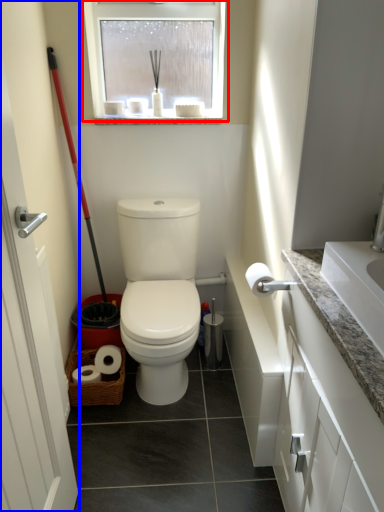
Question: Which of the following is the farthest to the observer, window (highlighted by a red box) or screen door (highlighted by a blue box)?

Choices:
 (A) window
 (B) screen door

Answer: (A)